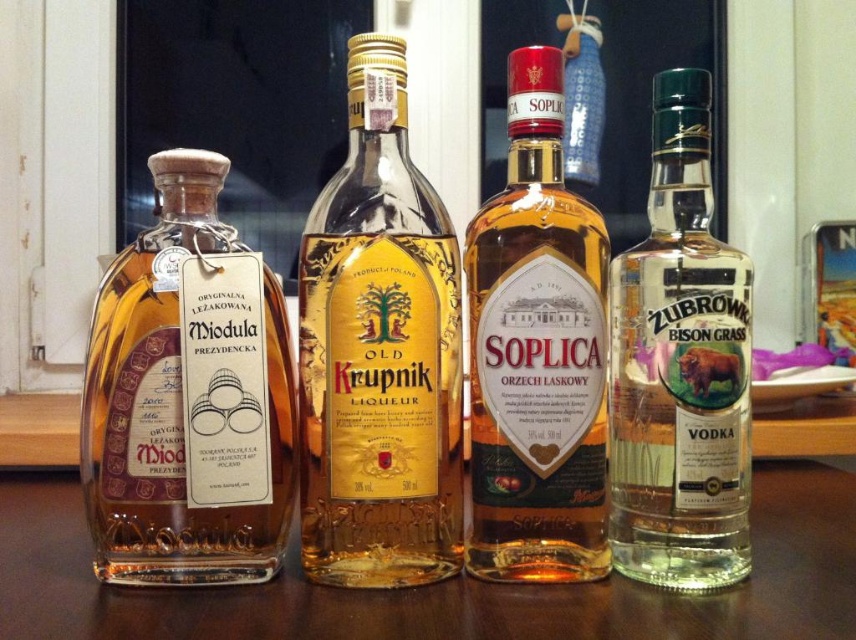
Who is more forward, (550, 413) or (623, 328)?

Point (550, 413) is in front.

The image size is (856, 640). I want to click on amber glass bottle at center, so click(538, 353).

Is point (400, 609) positioned in front of point (593, 394)?

Yes, point (400, 609) is in front of point (593, 394).

Is transparent glass bottles at center to the left of amber glass bottle at center from the viewer's perspective?

Indeed, transparent glass bottles at center is positioned on the left side of amber glass bottle at center.

The width and height of the screenshot is (856, 640). What are the coordinates of `transparent glass bottles at center` in the screenshot? It's located at (438, 584).

Measure the distance from transparent glass bottles at center to clear glass vodka at right.

A distance of 7.14 inches exists between transparent glass bottles at center and clear glass vodka at right.

Between transparent glass bottles at center and clear glass vodka at right, which one has less height?

With less height is transparent glass bottles at center.

Which is behind, point (138, 620) or point (654, 282)?

The point (654, 282) is more distant.

What are the coordinates of `transparent glass bottles at center` in the screenshot? It's located at (438, 584).